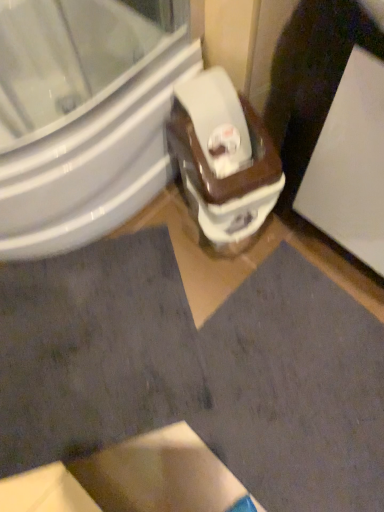
Question: In terms of height, does white glossy screen door at upper right look taller or shorter compared to white glossy toilet at center?

Choices:
 (A) tall
 (B) short

Answer: (A)

Question: In terms of width, does white glossy screen door at upper right look wider or thinner when compared to white glossy toilet at center?

Choices:
 (A) thin
 (B) wide

Answer: (B)

Question: Which is farther from the white glossy toilet at center?

Choices:
 (A) white glossy screen door at upper right
 (B) white glossy bidet at center
 (C) dark gray fabric at lower left

Answer: (C)

Question: Considering the real-world distances, which object is farthest from the white glossy toilet at center?

Choices:
 (A) white glossy bidet at center
 (B) white glossy screen door at upper right
 (C) dark gray fabric at lower left

Answer: (C)